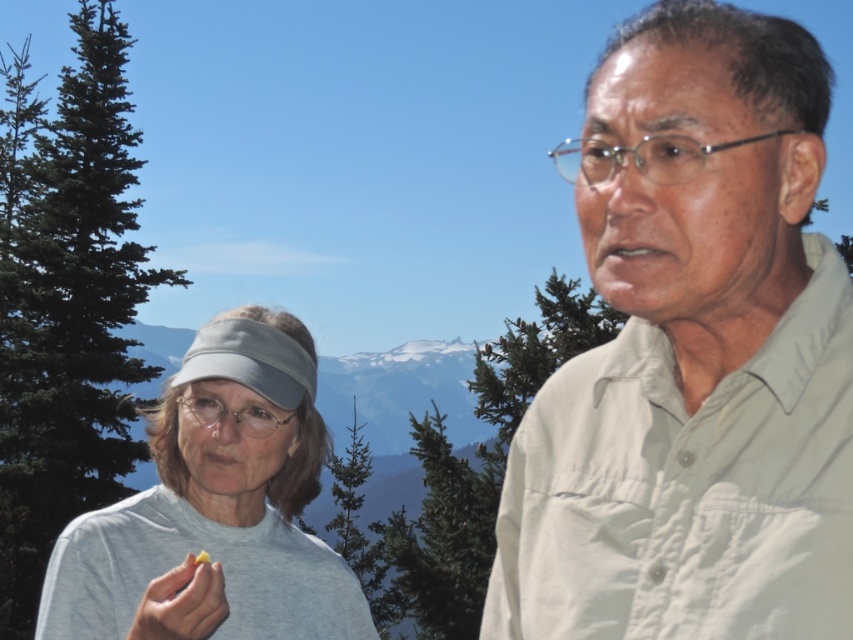
You are planning to plant a new tree in your backyard. You have two options from the image shown. Which tree, the green leafy tree at left or the green textured tree at center, would you choose if you want a taller tree?

The green leafy tree at left is much taller than the green textured tree at center, so you should choose the green leafy tree at left for a taller tree.

You are standing in a mountainous area and see the light beige shirt at right and the green textured pine tree at center. Which object is higher in the image?

The light beige shirt at right is located above the green textured pine tree at center in the image.

You are standing at the scenic viewpoint and see two points marked in the image. The first point is at coordinates point (154, 628) and the second point is at point (439, 465). Which point is closer to you?

Point (154, 628) is in front of point (439, 465), so it is closer to you.